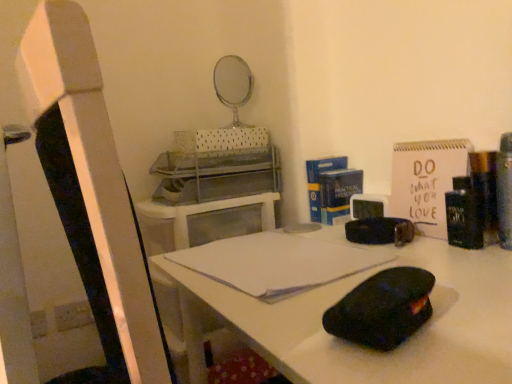
At what (x,y) coordinates should I click in order to perform the action: click on free spot above white paper notebook at center (from a real-world perspective). Please return your answer as a coordinate pair (x, y). The height and width of the screenshot is (384, 512). Looking at the image, I should click on (264, 252).